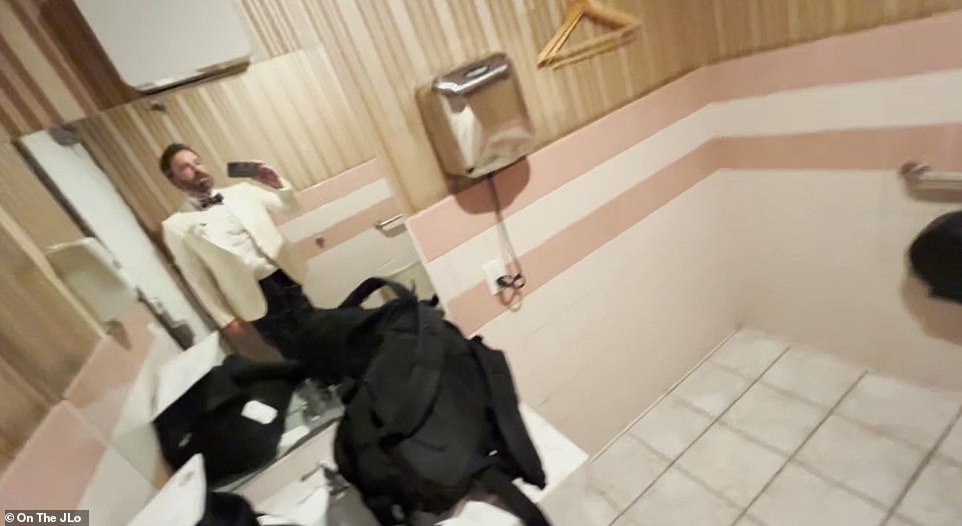
The height and width of the screenshot is (526, 962). In order to click on towels in this screenshot , I will do `click(476, 163)`.